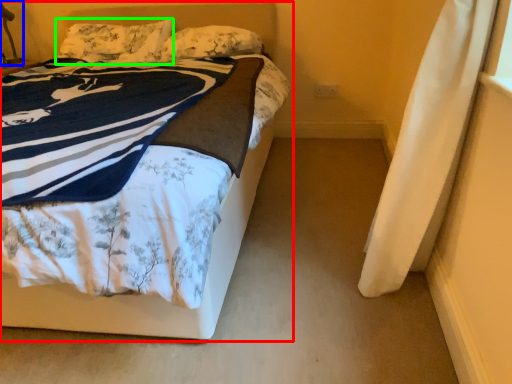
Question: Which is nearer to the bed (highlighted by a red box)? table lamp (highlighted by a blue box) or pillow (highlighted by a green box).

Choices:
 (A) table lamp
 (B) pillow

Answer: (B)